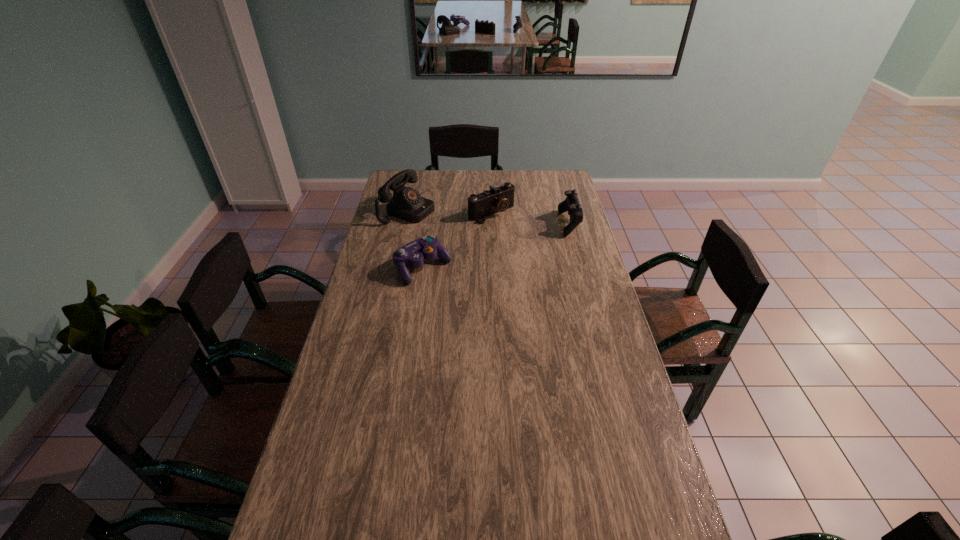
You are a GUI agent. You are given a task and a screenshot of the screen. Output one action in this format:
    pyautogui.click(x=<x>, y=<y>)
    Task: Click on the free spot on the desktop that is between the nearest object and the right control and is positioned on the dial of the tallest object
    This screenshot has height=540, width=960.
    Given the screenshot: What is the action you would take?
    pyautogui.click(x=504, y=243)

This screenshot has height=540, width=960. Find the location of `vacant space on the desktop that is between the shorter control and the taller control and is positioned on the front-facing side of the third object from left to right`. vacant space on the desktop that is between the shorter control and the taller control and is positioned on the front-facing side of the third object from left to right is located at coordinates (522, 238).